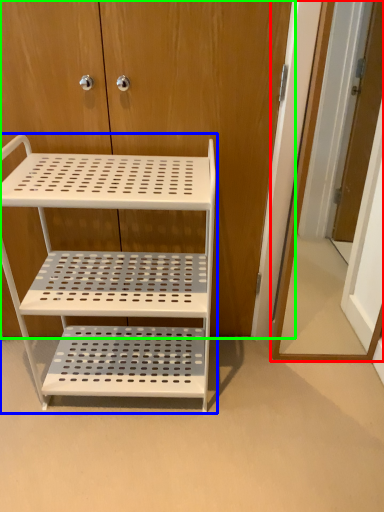
Question: Which is nearer to the door (highlighted by a red box)? shelf (highlighted by a blue box) or dresser (highlighted by a green box).

Choices:
 (A) shelf
 (B) dresser

Answer: (B)